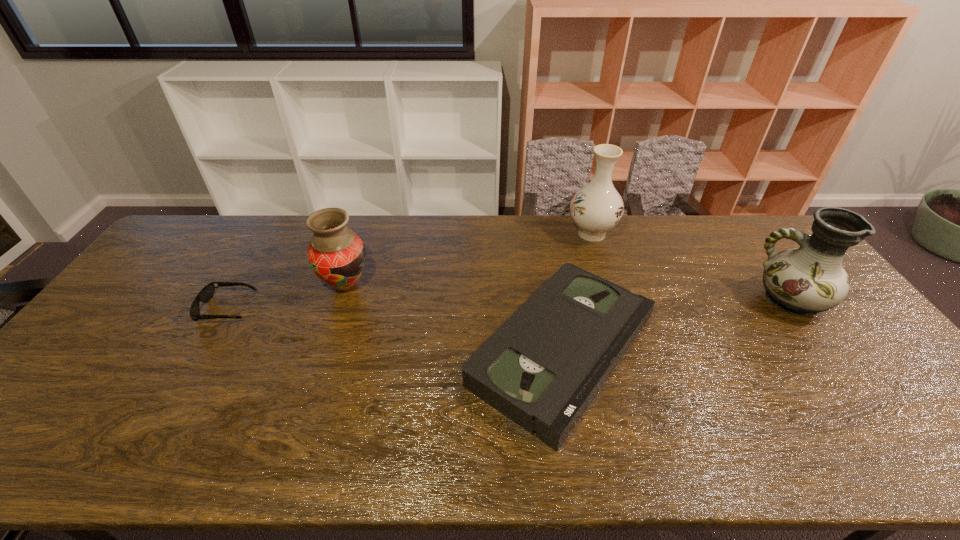
You are a GUI agent. You are given a task and a screenshot of the screen. Output one action in this format:
    pyautogui.click(x=<x>, y=<y>)
    Task: Click on the second vase from right to left
    
    Given the screenshot: What is the action you would take?
    pyautogui.click(x=596, y=208)

Find the location of `the farthest object`. the farthest object is located at coordinates (596, 208).

The height and width of the screenshot is (540, 960). I want to click on the rightmost object, so click(808, 280).

Locate an element on the screen. This screenshot has width=960, height=540. the leftmost vase is located at coordinates (336, 254).

Identify the location of the third tallest object. (336, 254).

Find the location of a particular element. videotape is located at coordinates (542, 368).

At what (x,y) coordinates should I click in order to perform the action: click on sunglasses. Please return your answer as a coordinate pair (x, y). Looking at the image, I should click on (206, 294).

Where is `the leftmost object`? Image resolution: width=960 pixels, height=540 pixels. the leftmost object is located at coordinates (206, 294).

Locate an element on the screen. The image size is (960, 540). free space located 0.320m on the left of the second vase from left to right is located at coordinates (475, 233).

Identify the location of vacant area situated 0.270m on the left of the rightmost vase. Image resolution: width=960 pixels, height=540 pixels. (662, 300).